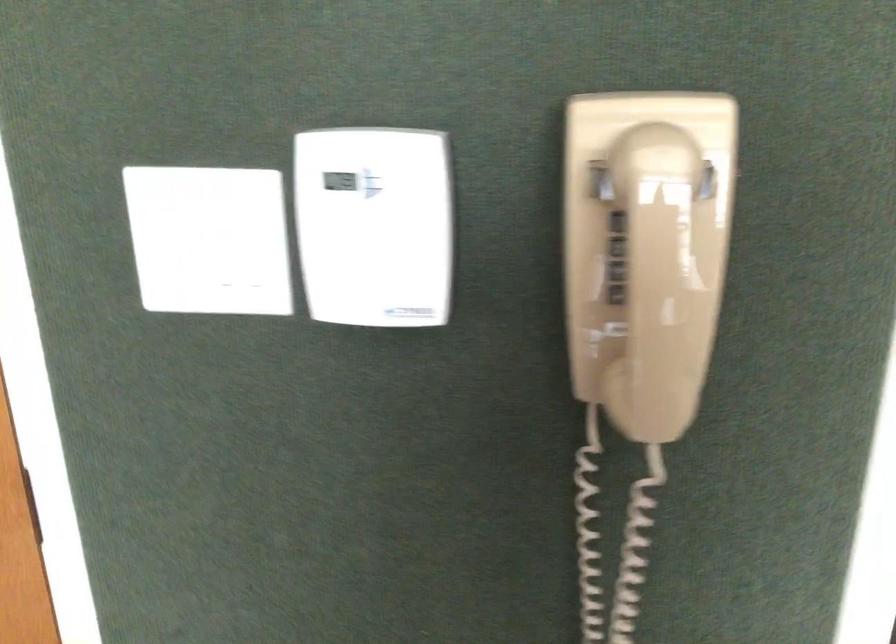
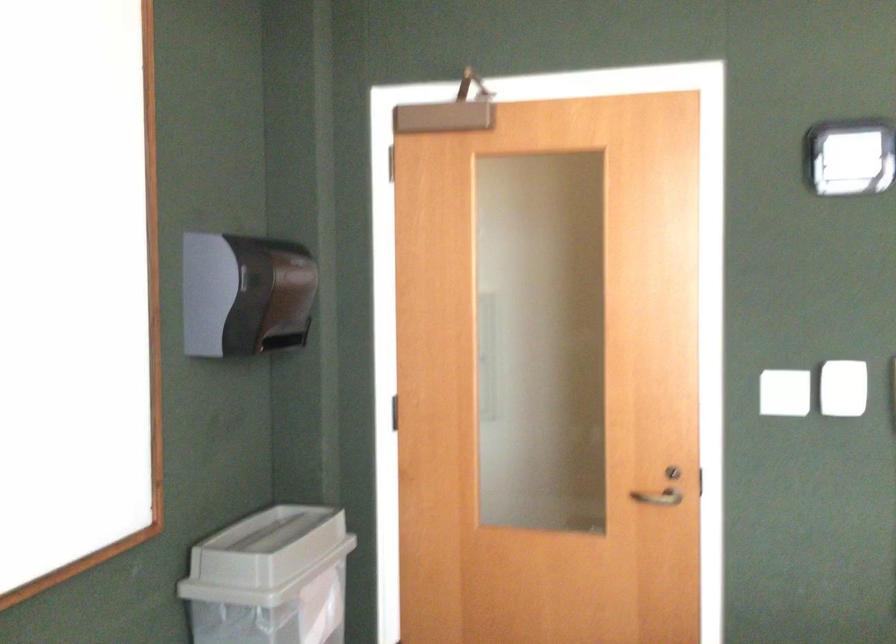
Question: In a continuous first-person perspective shot, in which direction is the camera moving?

Choices:
 (A) Left
 (B) Right
 (C) Forward
 (D) Backward

Answer: (D)